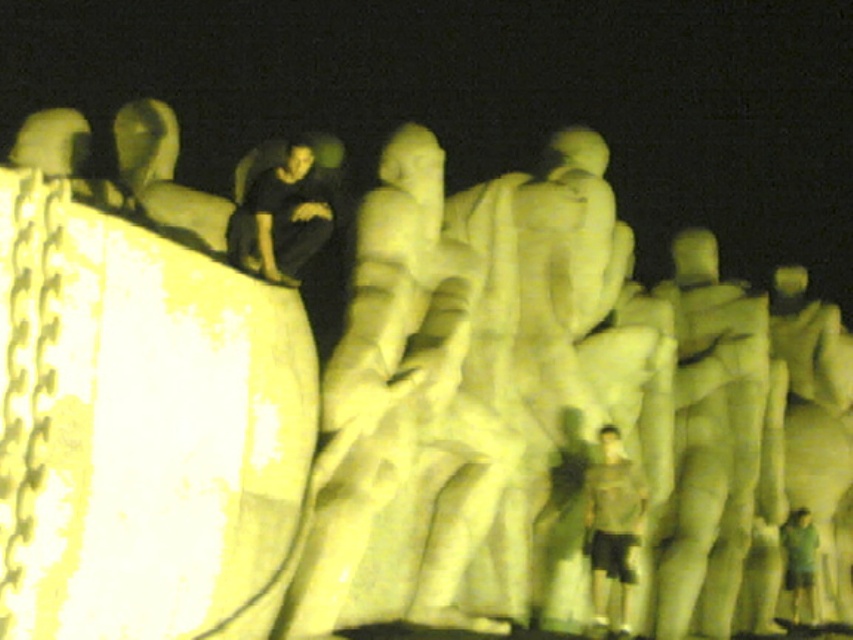
Is point (299, 154) positioned before point (625, 566)?

Yes.

From the picture: Does dark fabric pants at upper left have a lesser height compared to light brown fabric shirt at center?

Yes, dark fabric pants at upper left is shorter than light brown fabric shirt at center.

You are a GUI agent. You are given a task and a screenshot of the screen. Output one action in this format:
    pyautogui.click(x=<x>, y=<y>)
    Task: Click on the dark fabric pants at upper left
    Image resolution: width=853 pixels, height=640 pixels.
    Given the screenshot: What is the action you would take?
    pyautogui.click(x=277, y=212)

In order to click on dark fabric pants at upper left in this screenshot , I will do `click(277, 212)`.

Does point (252, 205) come in front of point (793, 508)?

Yes, it is in front of point (793, 508).

Who is taller, dark fabric pants at upper left or green fabric shirt at lower right?

Standing taller between the two is dark fabric pants at upper left.

Who is more distant from viewer, (x=283, y=205) or (x=787, y=529)?

The point (x=787, y=529) is more distant.

Where is `dark fabric pants at upper left`? The height and width of the screenshot is (640, 853). dark fabric pants at upper left is located at coordinates (277, 212).

Is point (602, 481) positioned after point (787, 556)?

No, it is not.

The height and width of the screenshot is (640, 853). What do you see at coordinates (612, 529) in the screenshot?
I see `light brown fabric shirt at center` at bounding box center [612, 529].

At what (x,y) coordinates should I click in order to perform the action: click on light brown fabric shirt at center. Please return your answer as a coordinate pair (x, y). This screenshot has height=640, width=853. Looking at the image, I should click on (612, 529).